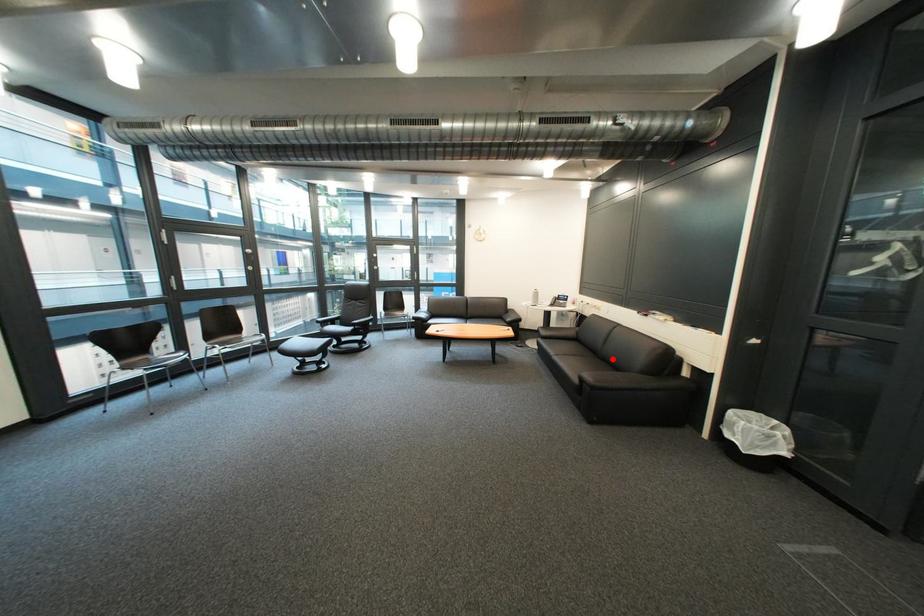
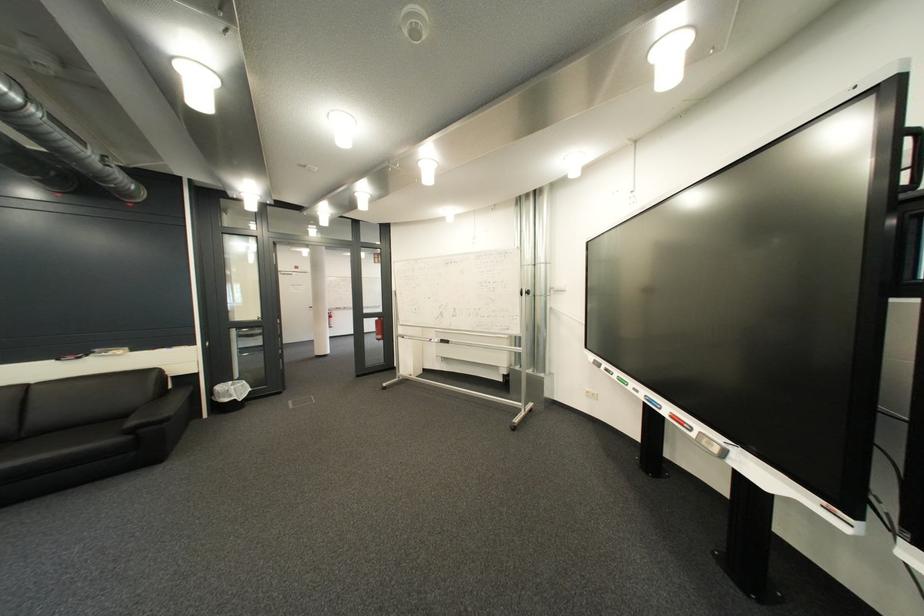
Where in the second image is the point corresponding to the highlighted location from the first image?

(35, 440)